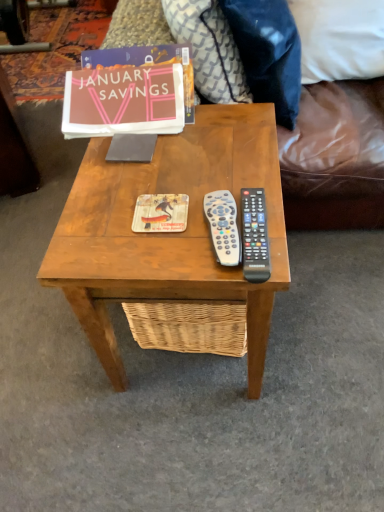
Question: Is white fabric pillow at upper right, which is the 1th pillow from right to left, shorter than white plastic remote at center, arranged as the 2th remote control when viewed from the right?

Choices:
 (A) yes
 (B) no

Answer: (B)

Question: Is white fabric pillow at upper right, which ranks as the third pillow in left-to-right order, turned away from white plastic remote at center, positioned as the first remote control in left-to-right order?

Choices:
 (A) yes
 (B) no

Answer: (B)

Question: Does white fabric pillow at upper right, which is the 1th pillow from right to left, have a larger size compared to white plastic remote at center, positioned as the first remote control in left-to-right order?

Choices:
 (A) no
 (B) yes

Answer: (B)

Question: Can you confirm if white fabric pillow at upper right, which is the 1th pillow from right to left, is positioned to the right of white plastic remote at center, arranged as the 2th remote control when viewed from the right?

Choices:
 (A) yes
 (B) no

Answer: (A)

Question: Is white fabric pillow at upper right, which ranks as the third pillow in left-to-right order, positioned beyond the bounds of white plastic remote at center, positioned as the first remote control in left-to-right order?

Choices:
 (A) yes
 (B) no

Answer: (A)

Question: In the image, is wooden coffee table at center on the left side or the right side of velvety dark blue pillow at upper right, which is counted as the second pillow, starting from the left?

Choices:
 (A) left
 (B) right

Answer: (A)

Question: Looking at their shapes, would you say wooden coffee table at center is wider or thinner than velvety dark blue pillow at upper right, marked as the 2th pillow in a right-to-left arrangement?

Choices:
 (A) thin
 (B) wide

Answer: (B)

Question: In terms of size, does wooden coffee table at center appear bigger or smaller than velvety dark blue pillow at upper right, marked as the 2th pillow in a right-to-left arrangement?

Choices:
 (A) big
 (B) small

Answer: (A)

Question: In terms of height, does wooden coffee table at center look taller or shorter compared to velvety dark blue pillow at upper right, which is counted as the second pillow, starting from the left?

Choices:
 (A) short
 (B) tall

Answer: (B)

Question: Based on their sizes in the image, would you say wooden coffee table at center is bigger or smaller than patterned fabric pillow at upper center, which ranks as the third pillow in right-to-left order?

Choices:
 (A) big
 (B) small

Answer: (A)

Question: In terms of height, does wooden coffee table at center look taller or shorter compared to patterned fabric pillow at upper center, which ranks as the third pillow in right-to-left order?

Choices:
 (A) short
 (B) tall

Answer: (B)

Question: From a real-world perspective, is wooden coffee table at center positioned above or below patterned fabric pillow at upper center, which ranks as the third pillow in right-to-left order?

Choices:
 (A) below
 (B) above

Answer: (A)

Question: Is point (92, 343) closer or farther from the camera than point (200, 19)?

Choices:
 (A) farther
 (B) closer

Answer: (B)

Question: From their relative heights in the image, would you say white plastic remote at center, arranged as the 2th remote control when viewed from the right, is taller or shorter than matte paper book at upper center?

Choices:
 (A) tall
 (B) short

Answer: (B)

Question: Looking at their shapes, would you say white plastic remote at center, positioned as the first remote control in left-to-right order, is wider or thinner than matte paper book at upper center?

Choices:
 (A) wide
 (B) thin

Answer: (B)